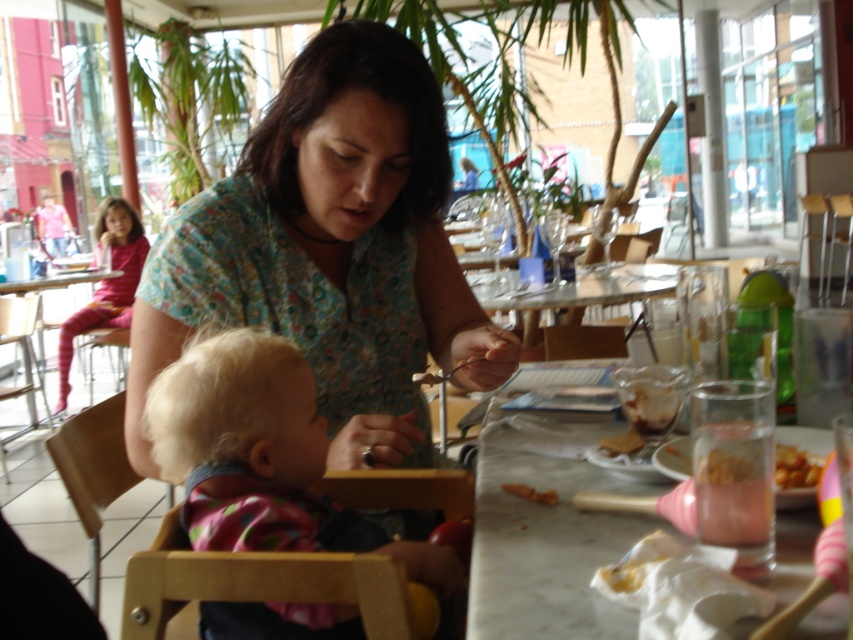
You are a customer at this dining establishment and want to sit at the marble table at lower right. Is the floral fabric shirt at center blocking your path to the table?

The floral fabric shirt at center is bigger than marble table at lower right, so yes, the floral fabric shirt at center is blocking your path to the marble table at lower right.

You are a parent trying to place your child in the wooden highchair at lower left. The highchair is located at point (93, 470). Can you determine the exact coordinates of the wooden highchair at lower left?

The wooden highchair at lower left is located at point (93, 470).

You are a parent trying to reach the golden crispy fries at table right while sitting in the wooden highchair at lower left. Can you easily grab them?

The wooden highchair at lower left is further to the viewer than golden crispy fries at table right, so the golden crispy fries at table right are closer to you and easier to grab.